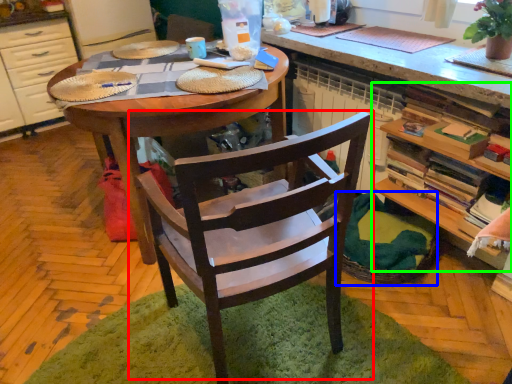
Question: Which is nearer to the chair (highlighted by a red box)? basket (highlighted by a blue box) or shelf (highlighted by a green box).

Choices:
 (A) basket
 (B) shelf

Answer: (A)